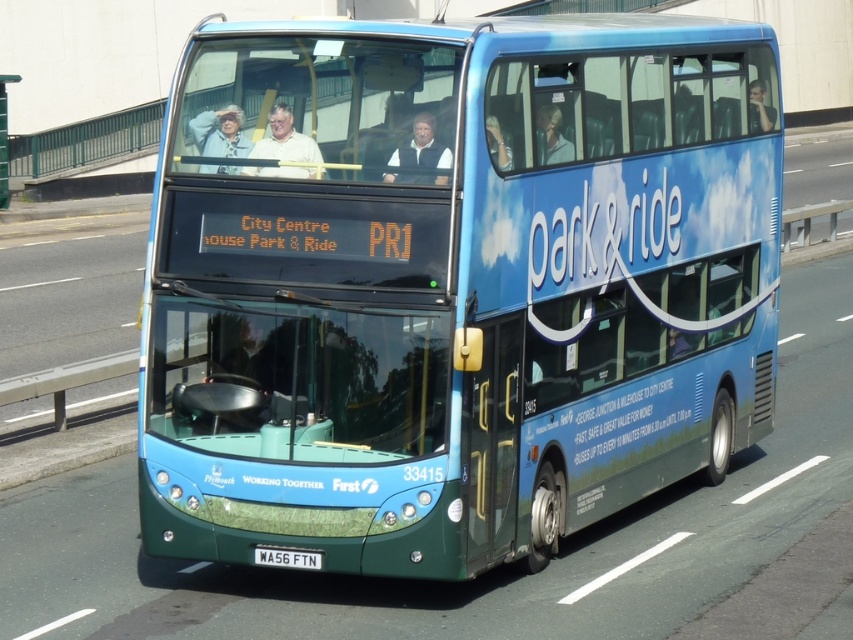
Question: Considering the relative positions of matte white shirt at upper center and matte white shirt at center in the image provided, where is matte white shirt at upper center located with respect to matte white shirt at center?

Choices:
 (A) right
 (B) left

Answer: (B)

Question: Can you confirm if matte white shirt at upper center is positioned to the right of black plastic license plate at lower center?

Choices:
 (A) no
 (B) yes

Answer: (B)

Question: Is matte white shirt at upper center further to camera compared to matte white shirt at center?

Choices:
 (A) no
 (B) yes

Answer: (B)

Question: Which point appears farthest from the camera in this image?

Choices:
 (A) (421, 122)
 (B) (276, 556)
 (C) (178, 408)

Answer: (C)

Question: Based on their relative distances, which object is nearer to the matte white shirt at upper center?

Choices:
 (A) blue metallic bus at center
 (B) matte white shirt at center

Answer: (B)

Question: Estimate the real-world distances between objects in this image. Which object is farther from the blue metallic bus at center?

Choices:
 (A) matte white shirt at upper center
 (B) black plastic license plate at lower center
 (C) matte white shirt at center

Answer: (C)